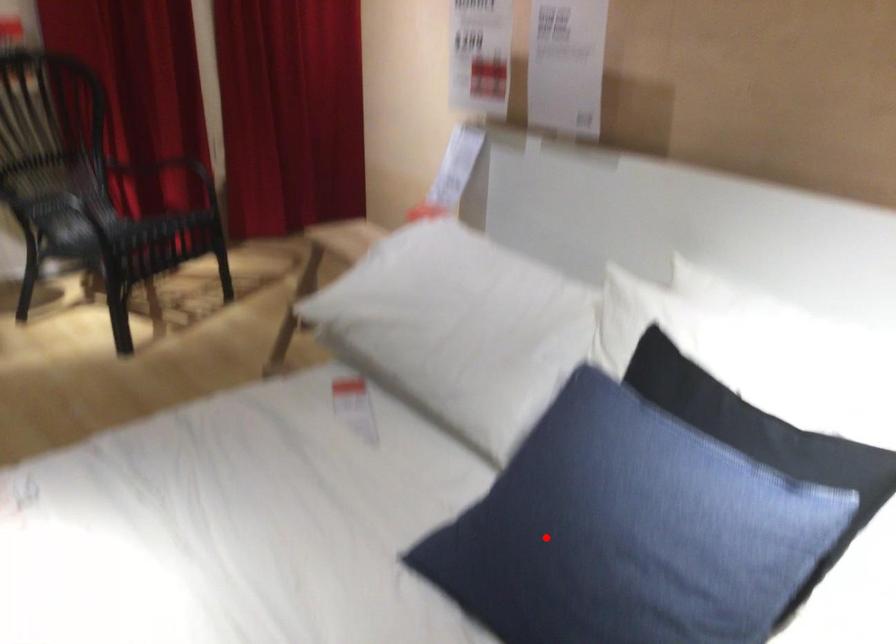
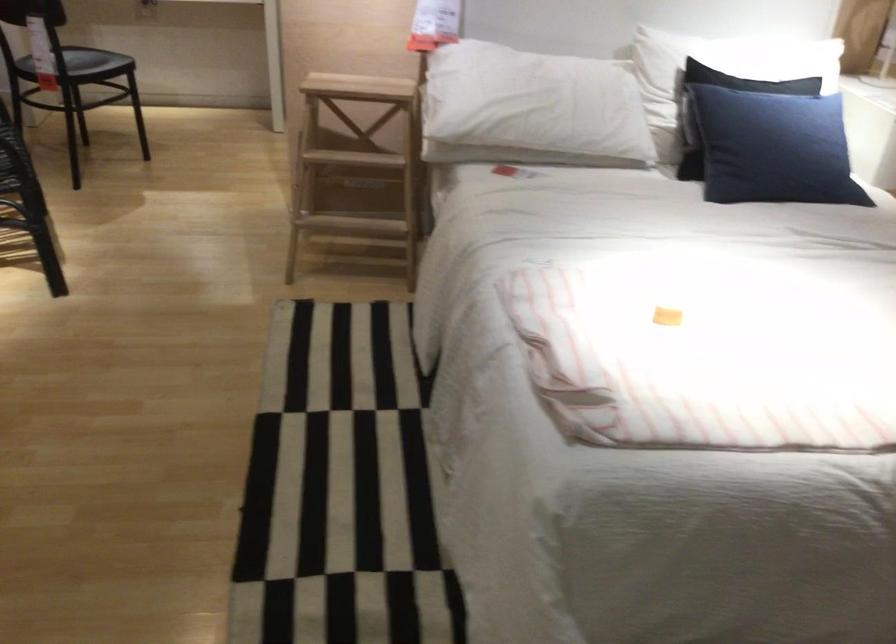
Find the pixel in the second image that matches the highlighted location in the first image.

(773, 147)